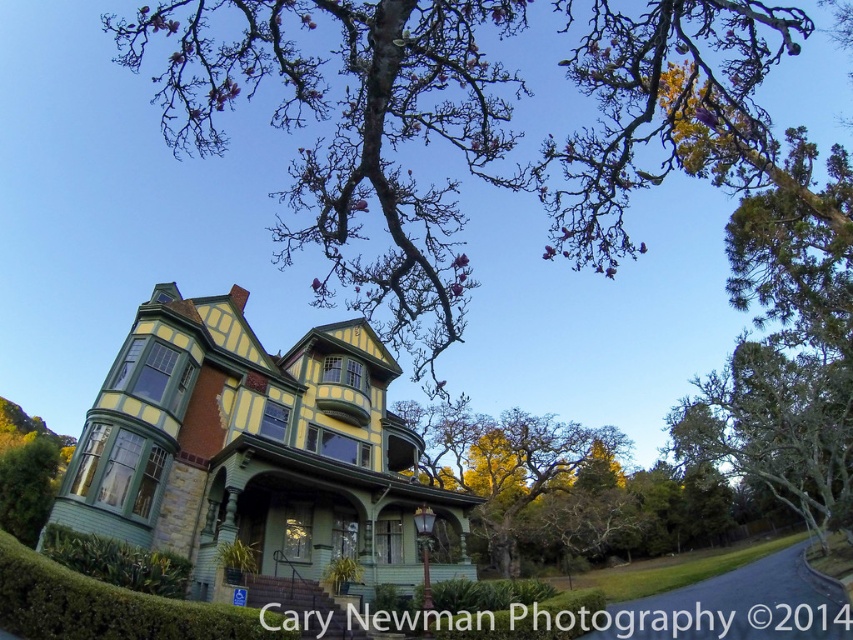
You are a gardener planning to trim the bare branches at upper center and the green leafy tree at center. Which tree is located above the other?

The bare branches at upper center is positioned over the green leafy tree at center, so it is located above the other.

You are standing in front of the Victorian house and want to locate the bare branches at upper center. According to the coordinates provided, where would you look relative to the center of the image?

The bare branches at upper center are located at coordinates point 0.195 on the x axis and 0.544 on the y axis, which means they are positioned slightly to the left and above the center of the image.

You are standing in front of the Victorian house and want to know which tree has a bigger size between the bare branches at upper center and the green leafy tree at right. Can you tell me?

The bare branches at upper center has a larger size compared to the green leafy tree at right, so the bare branches at upper center is bigger in size.